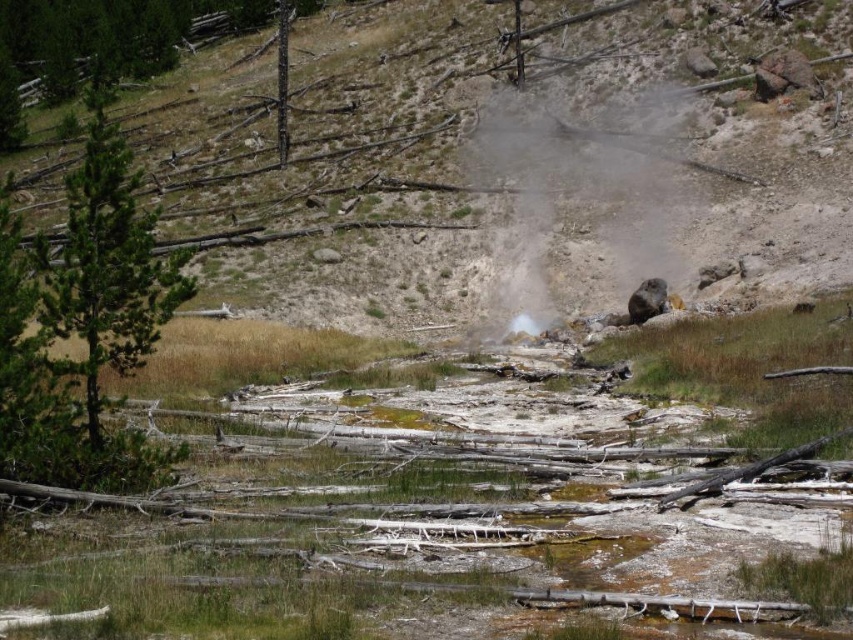
Who is positioned more to the right, gray dusty rock at center or green textured pine tree at left?

gray dusty rock at center

Consider the image. Measure the distance between point (641, 224) and camera.

The distance of point (641, 224) from camera is 50.70 meters.

Between point (531, 227) and point (73, 193), which one is positioned in front?

Point (73, 193) is in front.

At what (x,y) coordinates should I click in order to perform the action: click on gray dusty rock at center. Please return your answer as a coordinate pair (x, y). The image size is (853, 640). Looking at the image, I should click on (579, 202).

Which is in front, point (735, 163) or point (531, 202)?

Point (735, 163) is more forward.

Is brown dirt hillside at center above gray dusty rock at center?

Indeed, brown dirt hillside at center is positioned over gray dusty rock at center.

Locate an element on the screen. This screenshot has height=640, width=853. brown dirt hillside at center is located at coordinates (517, 164).

Which of these two, brown dirt hillside at center or green textured pine tree at left, stands taller?

Standing taller between the two is brown dirt hillside at center.

In the scene shown: Who is more forward, (685, 264) or (149, 458)?

Point (149, 458) is in front.

Find the location of a particular element. The height and width of the screenshot is (640, 853). brown dirt hillside at center is located at coordinates (517, 164).